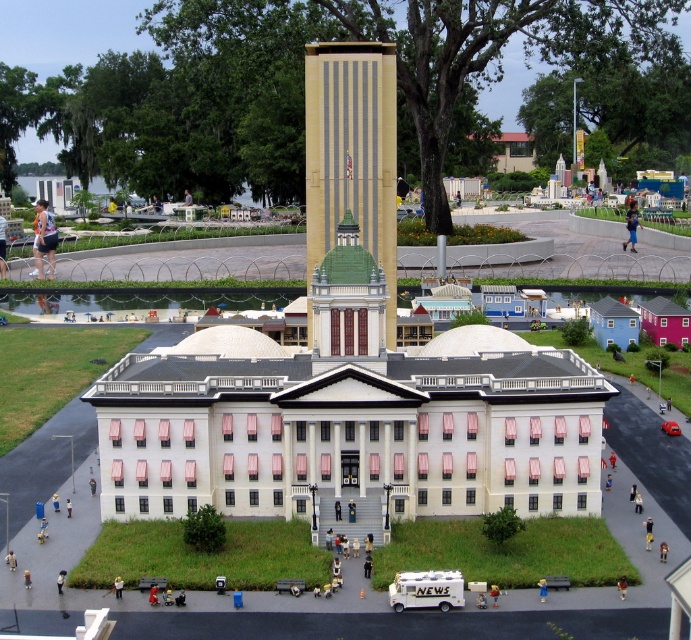
You are a visitor at the miniature model and want to place a small toy car between the beige textured tower at center and the light blue jeans at center. Can you do this without the car overlapping either object?

The beige textured tower at center is positioned over light blue jeans at center, meaning they are stacked vertically. Since they are not side by side, there is no horizontal space between them to place the toy car without overlapping. Therefore, it is not possible to place the car between them without overlapping either object.

You are a visitor standing in the plaza looking at the beige textured tower at center and the matte black shorts at lower left. Which object appears taller from your perspective?

The beige textured tower at center appears much taller than the matte black shorts at lower left from your perspective.

You are organizing a miniature scene and need to place the matte black shorts at lower left and the light blue jeans at center. Since space is limited, which object should you prioritize placing first to ensure both fit?

The matte black shorts at lower left should be placed first because it occupies less space than the light blue jeans at center, allowing both to fit in the limited area.